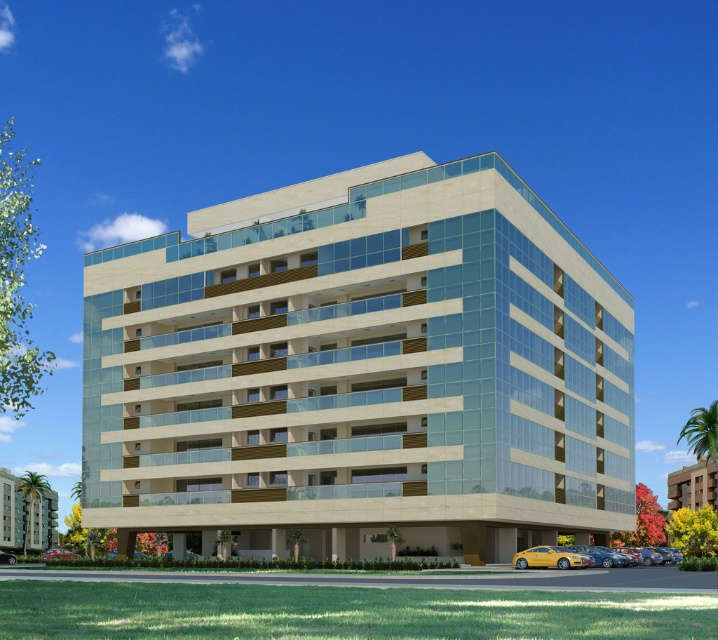
Question: Which object is positioned closest to the yellow matte car at lower center?

Choices:
 (A) beige stone building at lower left
 (B) beige stone hotel at lower right
 (C) beige stone building at center
 (D) metallic red car at lower left

Answer: (C)

Question: Estimate the real-world distances between objects in this image. Which object is closer to the yellow matte car at lower center?

Choices:
 (A) beige stone building at lower left
 (B) metallic red car at lower left
 (C) metallic silver car at lower left

Answer: (B)

Question: Is beige stone building at lower left positioned in front of yellow matte car at lower center?

Choices:
 (A) no
 (B) yes

Answer: (A)

Question: Which point is closer to the camera?

Choices:
 (A) beige stone building at lower left
 (B) metallic silver car at lower left
 (C) yellow matte car at lower center

Answer: (C)

Question: Is the position of beige stone building at lower left less distant than that of yellow matte car at lower right?

Choices:
 (A) no
 (B) yes

Answer: (A)

Question: Is beige stone building at center positioned in front of metallic red car at lower left?

Choices:
 (A) yes
 (B) no

Answer: (A)